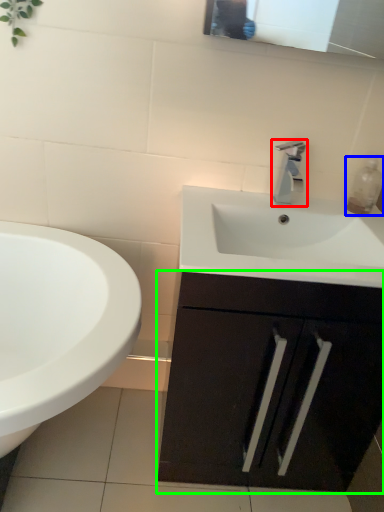
Question: Estimate the real-world distances between objects in this image. Which object is farther from tap (highlighted by a red box), soap dispenser (highlighted by a blue box) or bathroom cabinet (highlighted by a green box)?

Choices:
 (A) soap dispenser
 (B) bathroom cabinet

Answer: (B)